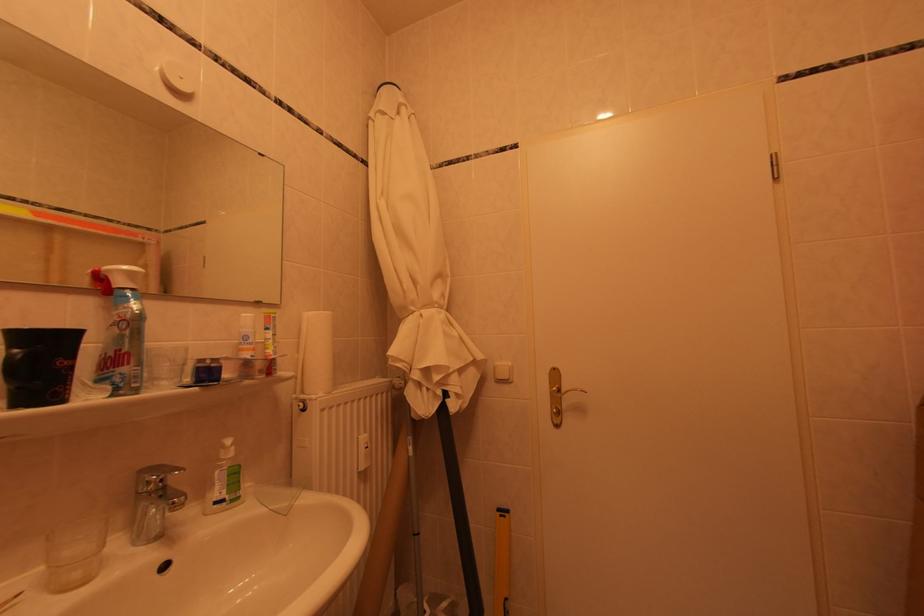
Find where to squeez the white tube bottle. Please return your answer as a coordinate pair (x, y).

(122, 330)